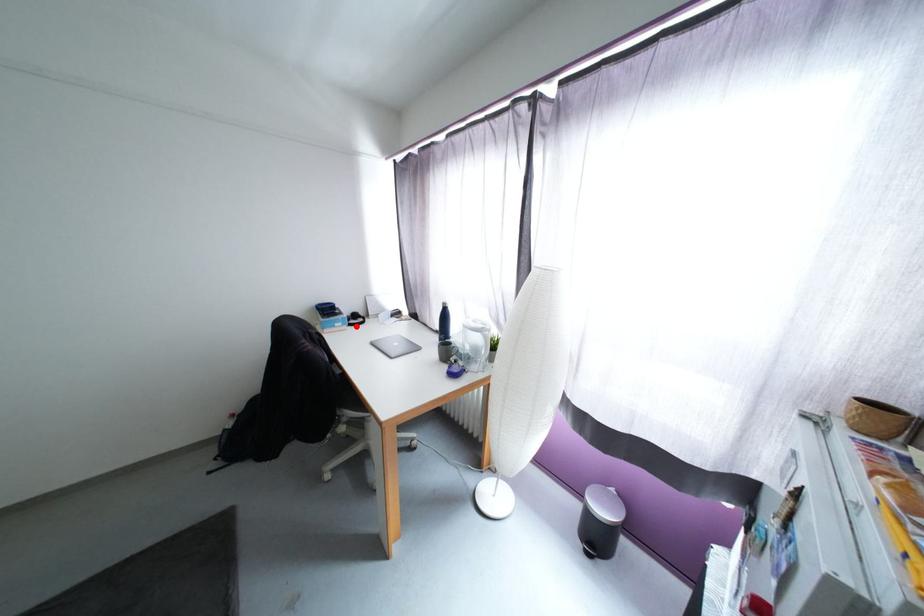
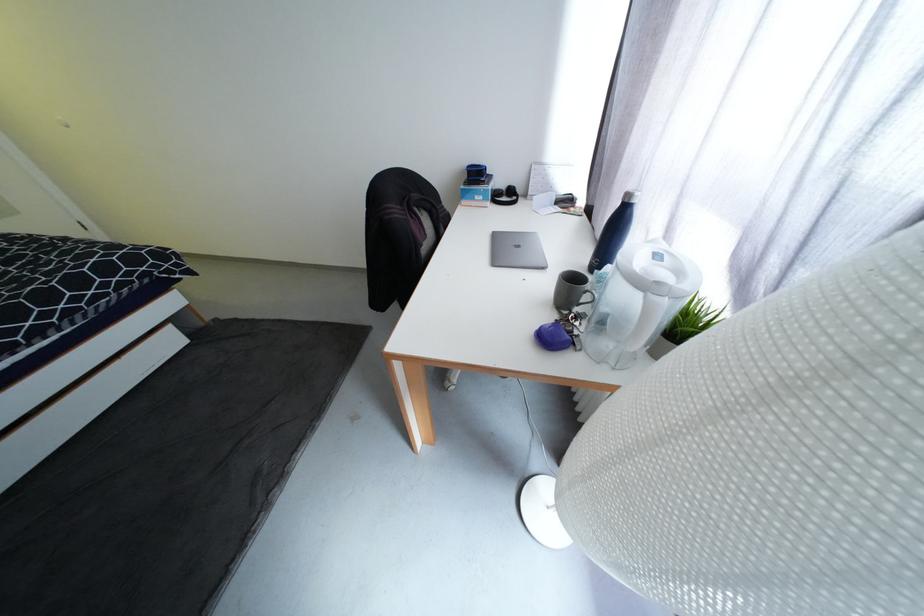
Question: I am providing you with two images of the same scene from different viewpoints. A red point is shown in image1. For the corresponding object point in image2, is it positioned nearer or farther from the camera?

Choices:
 (A) Nearer
 (B) Farther

Answer: (A)